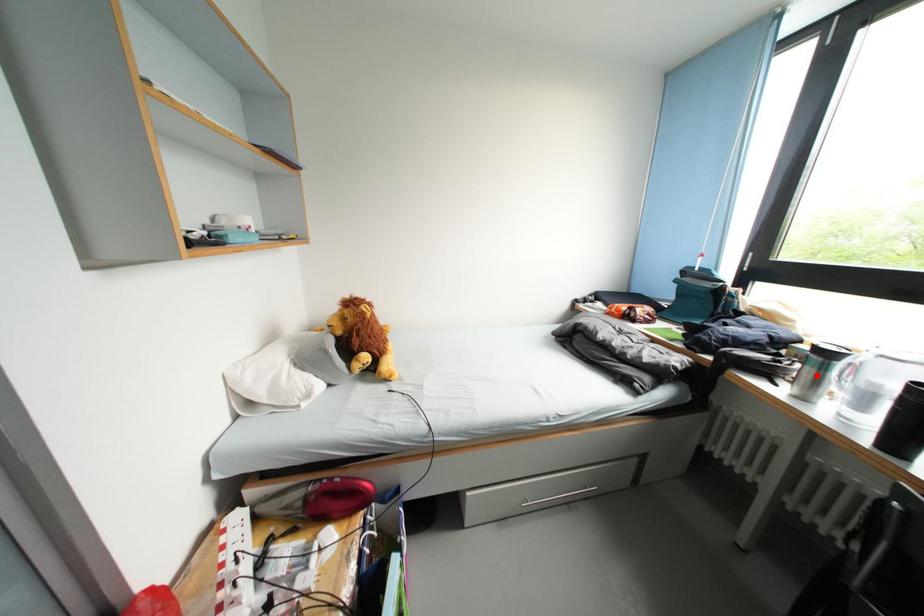
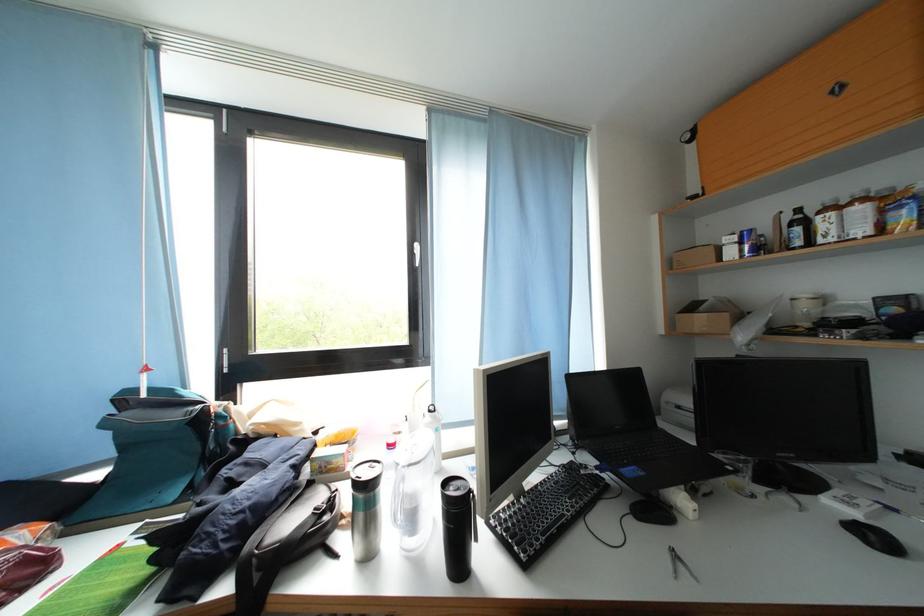
Where in the second image is the point corresponding to the highlighted location from the first image?

(369, 521)